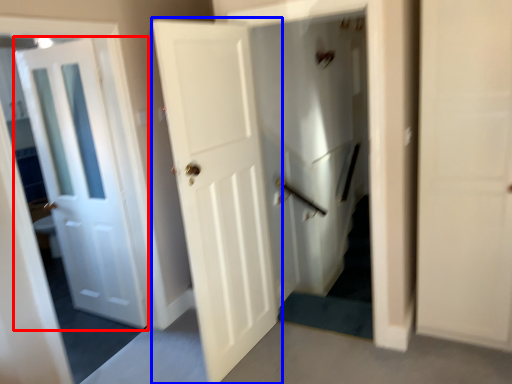
Question: Which object appears closest to the camera in this image, door (highlighted by a red box) or door (highlighted by a blue box)?

Choices:
 (A) door
 (B) door

Answer: (B)